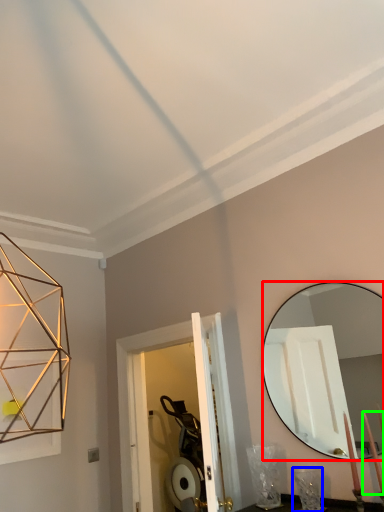
Question: Which object is the closest to the mirror (highlighted by a red box)? Choose among these: table lamp (highlighted by a blue box) or candle (highlighted by a green box).

Choices:
 (A) table lamp
 (B) candle

Answer: (A)